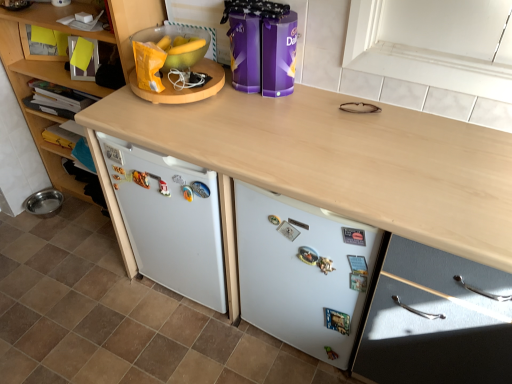
The height and width of the screenshot is (384, 512). I want to click on free space above white glossy tile at lower center (from a real-world perspective), so click(x=123, y=316).